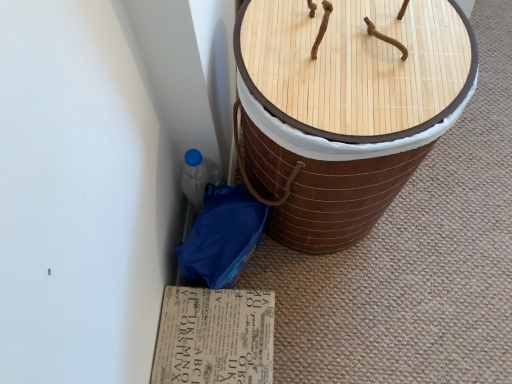
Question: Is printed cardboard at lower center in front of or behind bamboo basket at center in the image?

Choices:
 (A) front
 (B) behind

Answer: (B)

Question: Is point (207, 316) positioned closer to the camera than point (306, 170)?

Choices:
 (A) farther
 (B) closer

Answer: (A)

Question: In terms of height, does printed cardboard at lower center look taller or shorter compared to bamboo basket at center?

Choices:
 (A) short
 (B) tall

Answer: (A)

Question: Considering the positions of point (460, 86) and point (245, 329), is point (460, 86) closer or farther from the camera than point (245, 329)?

Choices:
 (A) farther
 (B) closer

Answer: (B)

Question: Relative to printed cardboard at lower center, is bamboo basket at center in front or behind?

Choices:
 (A) behind
 (B) front

Answer: (B)

Question: Based on their positions, is bamboo basket at center located to the left or right of printed cardboard at lower center?

Choices:
 (A) right
 (B) left

Answer: (A)

Question: Looking at their shapes, would you say bamboo basket at center is wider or thinner than printed cardboard at lower center?

Choices:
 (A) wide
 (B) thin

Answer: (A)